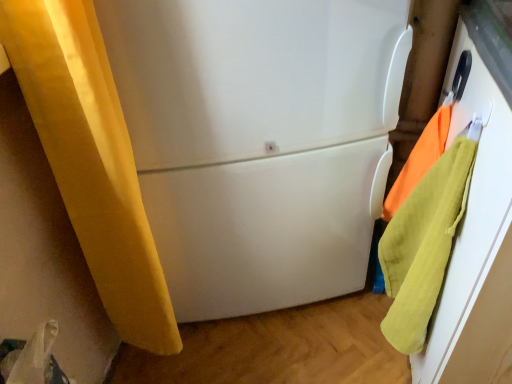
Question: Is orange cotton towel at right, which appears as the 2th beach towel when ordered from the bottom, positioned in front of white glossy refrigerator at center?

Choices:
 (A) yes
 (B) no

Answer: (B)

Question: From a real-world perspective, is orange cotton towel at right, which is the 1th beach towel from top to bottom, physically above white glossy refrigerator at center?

Choices:
 (A) no
 (B) yes

Answer: (B)

Question: Can you confirm if orange cotton towel at right, which is the 1th beach towel from top to bottom, is positioned to the left of white glossy refrigerator at center?

Choices:
 (A) no
 (B) yes

Answer: (A)

Question: Considering the relative sizes of orange cotton towel at right, which appears as the 2th beach towel when ordered from the bottom, and white glossy refrigerator at center in the image provided, is orange cotton towel at right, which appears as the 2th beach towel when ordered from the bottom, bigger than white glossy refrigerator at center?

Choices:
 (A) no
 (B) yes

Answer: (A)

Question: Are orange cotton towel at right, which is the 1th beach towel from top to bottom, and white glossy refrigerator at center far apart?

Choices:
 (A) yes
 (B) no

Answer: (B)

Question: Is orange cotton towel at right, which appears as the 2th beach towel when ordered from the bottom, to the left or to the right of soft yellow towel at right, positioned as the first beach towel in bottom-to-top order, in the image?

Choices:
 (A) left
 (B) right

Answer: (B)

Question: In terms of height, does orange cotton towel at right, which is the 1th beach towel from top to bottom, look taller or shorter compared to soft yellow towel at right, positioned as the first beach towel in bottom-to-top order?

Choices:
 (A) tall
 (B) short

Answer: (B)

Question: Is orange cotton towel at right, which is the 1th beach towel from top to bottom, wider or thinner than soft yellow towel at right, marked as the second beach towel in a top-to-bottom arrangement?

Choices:
 (A) thin
 (B) wide

Answer: (A)

Question: Is orange cotton towel at right, which is the 1th beach towel from top to bottom, inside the boundaries of soft yellow towel at right, positioned as the first beach towel in bottom-to-top order, or outside?

Choices:
 (A) outside
 (B) inside

Answer: (A)

Question: Would you say soft yellow towel at right, positioned as the first beach towel in bottom-to-top order, is to the left or to the right of orange cotton towel at right, which is the 1th beach towel from top to bottom, in the picture?

Choices:
 (A) left
 (B) right

Answer: (A)

Question: From the image's perspective, is soft yellow towel at right, marked as the second beach towel in a top-to-bottom arrangement, located above or below orange cotton towel at right, which is the 1th beach towel from top to bottom?

Choices:
 (A) below
 (B) above

Answer: (A)

Question: Is point (428, 230) closer or farther from the camera than point (388, 215)?

Choices:
 (A) closer
 (B) farther

Answer: (A)

Question: Is soft yellow towel at right, marked as the second beach towel in a top-to-bottom arrangement, taller or shorter than orange cotton towel at right, which appears as the 2th beach towel when ordered from the bottom?

Choices:
 (A) short
 (B) tall

Answer: (B)

Question: From the image's perspective, is white glossy refrigerator at center positioned above or below orange cotton towel at right, which is the 1th beach towel from top to bottom?

Choices:
 (A) above
 (B) below

Answer: (A)

Question: Considering the relative positions of white glossy refrigerator at center and orange cotton towel at right, which is the 1th beach towel from top to bottom, in the image provided, is white glossy refrigerator at center to the left or to the right of orange cotton towel at right, which is the 1th beach towel from top to bottom,?

Choices:
 (A) right
 (B) left

Answer: (B)